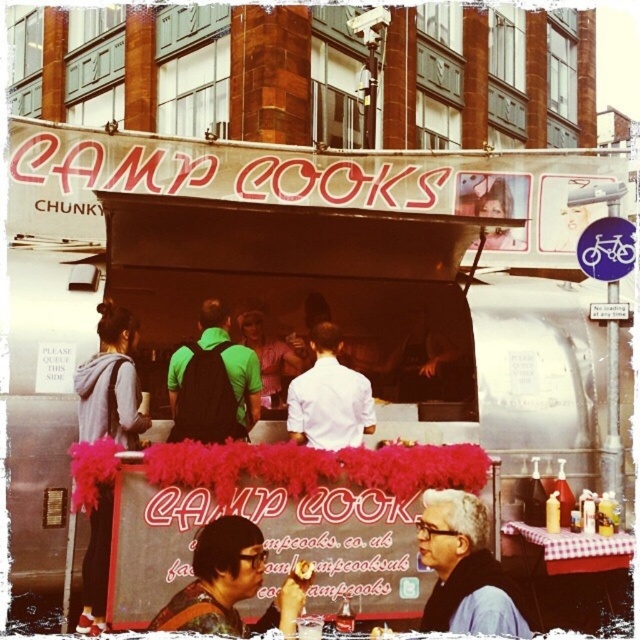
Question: Is white shirt at center above matte green shirt at center?

Choices:
 (A) yes
 (B) no

Answer: (B)

Question: Is matte black shirt at lower center above matte green shirt at center?

Choices:
 (A) no
 (B) yes

Answer: (A)

Question: Which of the following is the farthest from the observer?

Choices:
 (A) white shirt at center
 (B) matte black shirt at lower center

Answer: (A)

Question: In this image, where is gray fabric shirt at center located relative to green matte backpack at center?

Choices:
 (A) above
 (B) below

Answer: (B)

Question: Which point is closer to the camera taking this photo?

Choices:
 (A) (88, 563)
 (B) (305, 564)
 (C) (179, 358)
 (D) (317, 406)

Answer: (B)

Question: Estimate the real-world distances between objects in this image. Which object is closer to the green matte backpack at center?

Choices:
 (A) gray hoodie at left
 (B) gray fabric shirt at center

Answer: (A)